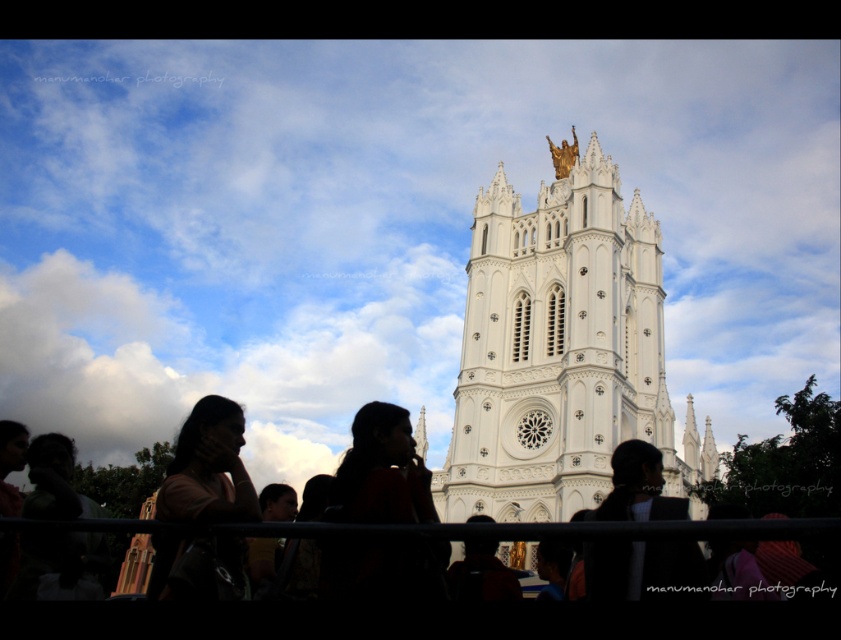
You are a photographer trying to capture the golden statue atop the cathedral. You notice two elements in your frame that might obstruct your view. One is the black fabric at center and the other is the dark hair at lower left. Which of these two elements is less likely to block your view of the statue?

The black fabric at center is shorter than the dark hair at lower left, so the black fabric at center is less likely to block your view of the statue because it is shorter and might be positioned lower in the frame.

You are standing at the base of the cathedral and notice a point marked at coordinates (641, 568). According to the image, what object or feature is located at that specific coordinate?

The point at coordinates (641, 568) corresponds to the black fabric at center.